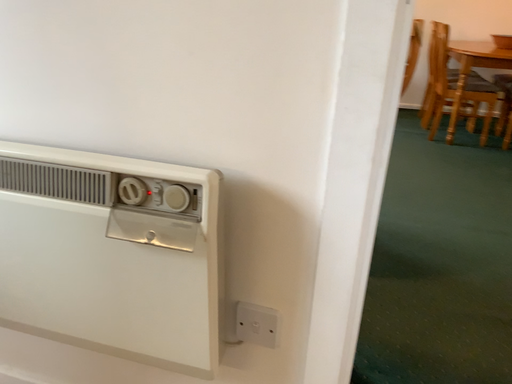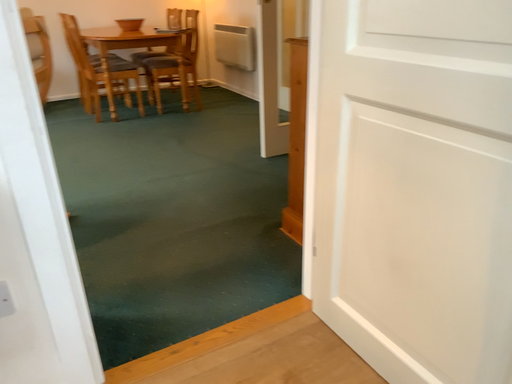
Question: Which way did the camera rotate in the video?

Choices:
 (A) rotated left
 (B) rotated right

Answer: (B)